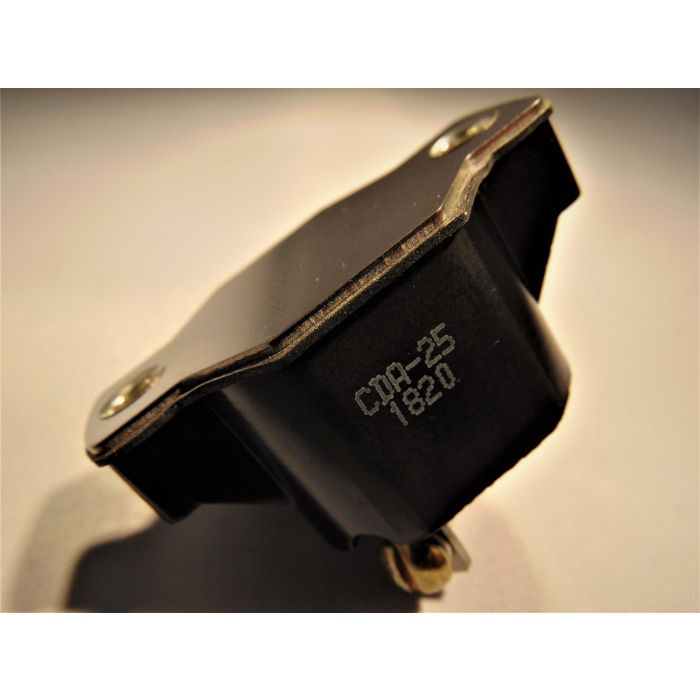
Locate an element on the screen. screw hole is located at coordinates (111, 398).